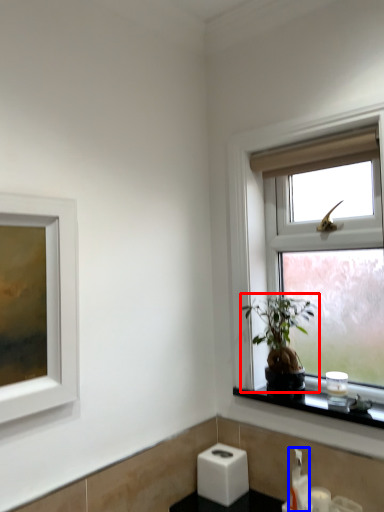
Question: Which point is closer to the camera, houseplant (highlighted by a red box) or soap dispenser (highlighted by a blue box)?

Choices:
 (A) houseplant
 (B) soap dispenser

Answer: (A)